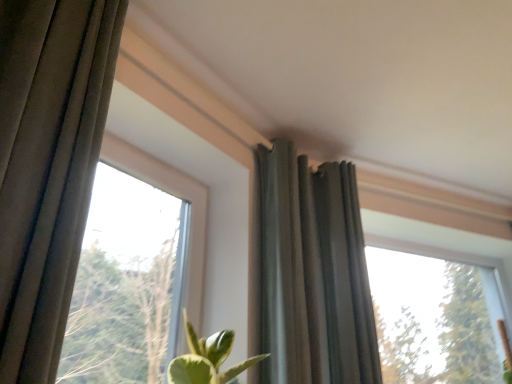
Question: Is the position of transparent glass window at upper right, the 2th window in the left-to-right sequence, less distant than that of dark gray fabric curtain at upper center?

Choices:
 (A) no
 (B) yes

Answer: (A)

Question: Is transparent glass window at upper right, the 1th window positioned from the back, smaller than dark gray fabric curtain at upper center?

Choices:
 (A) no
 (B) yes

Answer: (A)

Question: Considering the relative sizes of transparent glass window at upper right, arranged as the 2th window when viewed from the front, and dark gray fabric curtain at upper center in the image provided, is transparent glass window at upper right, arranged as the 2th window when viewed from the front, thinner than dark gray fabric curtain at upper center?

Choices:
 (A) yes
 (B) no

Answer: (A)

Question: From the image's perspective, would you say transparent glass window at upper right, marked as the 1th window in a right-to-left arrangement, is positioned over dark gray fabric curtain at upper center?

Choices:
 (A) no
 (B) yes

Answer: (A)

Question: Does transparent glass window at upper right, marked as the 1th window in a right-to-left arrangement, have a larger size compared to dark gray fabric curtain at upper center?

Choices:
 (A) no
 (B) yes

Answer: (B)

Question: Considering the positions of point (362, 266) and point (192, 233), is point (362, 266) closer or farther from the camera than point (192, 233)?

Choices:
 (A) farther
 (B) closer

Answer: (A)

Question: Is dark gray fabric curtain at upper center wider or thinner than transparent glass window at upper left, the first window viewed from the front?

Choices:
 (A) wide
 (B) thin

Answer: (A)

Question: From the image's perspective, relative to transparent glass window at upper left, which is the first window from left to right, is dark gray fabric curtain at upper center above or below?

Choices:
 (A) below
 (B) above

Answer: (B)

Question: Considering the positions of dark gray fabric curtain at upper center and transparent glass window at upper left, which is the first window from left to right, in the image, is dark gray fabric curtain at upper center bigger or smaller than transparent glass window at upper left, which is the first window from left to right,?

Choices:
 (A) small
 (B) big

Answer: (B)

Question: Which is correct: dark gray fabric curtain at upper center is inside transparent glass window at upper right, marked as the 1th window in a right-to-left arrangement, or outside of it?

Choices:
 (A) inside
 (B) outside

Answer: (B)

Question: Is point (358, 243) positioned closer to the camera than point (437, 284)?

Choices:
 (A) farther
 (B) closer

Answer: (B)

Question: Considering their positions, is dark gray fabric curtain at upper center located in front of or behind transparent glass window at upper right, arranged as the 2th window when viewed from the front?

Choices:
 (A) behind
 (B) front

Answer: (B)

Question: In terms of size, does dark gray fabric curtain at upper center appear bigger or smaller than transparent glass window at upper right, arranged as the 2th window when viewed from the front?

Choices:
 (A) small
 (B) big

Answer: (A)

Question: Is transparent glass window at upper right, the 2th window in the left-to-right sequence, inside or outside of transparent glass window at upper left, the first window viewed from the front?

Choices:
 (A) outside
 (B) inside

Answer: (A)

Question: Looking at their shapes, would you say transparent glass window at upper right, the 2th window in the left-to-right sequence, is wider or thinner than transparent glass window at upper left, which appears as the 2th window when viewed from the back?

Choices:
 (A) wide
 (B) thin

Answer: (A)